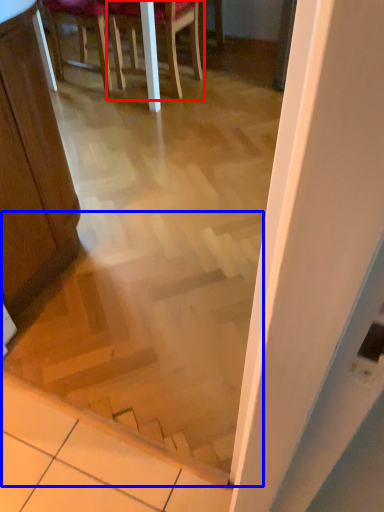
Question: Among these objects, which one is nearest to the camera, chair (highlighted by a red box) or stairwell (highlighted by a blue box)?

Choices:
 (A) chair
 (B) stairwell

Answer: (B)